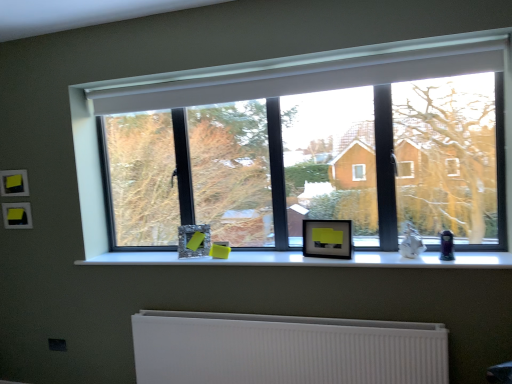
This screenshot has height=384, width=512. I want to click on vacant space in front of black matte picture frame at center, which is the 2th picture frame in back-to-front order, so click(336, 261).